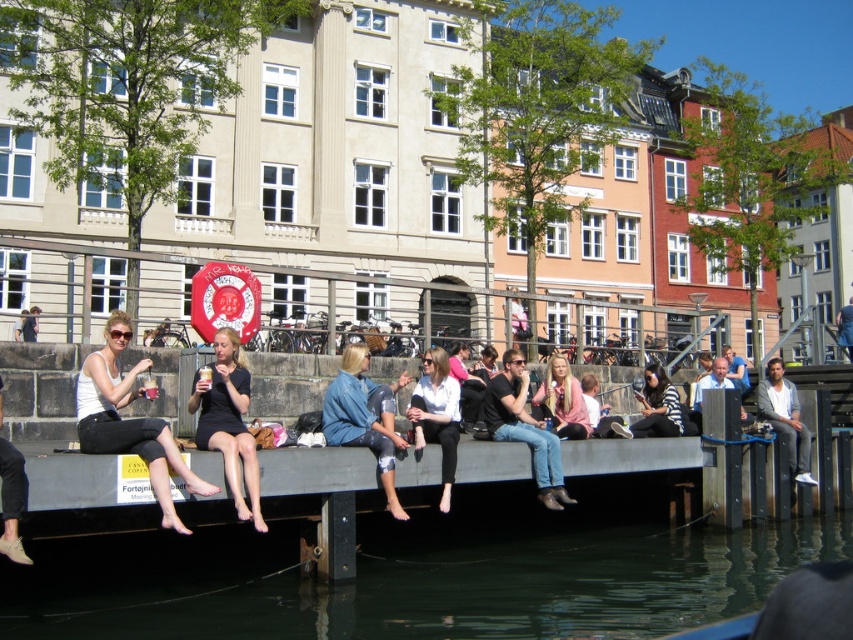
Does matte black pants at lower left appear under dark blue jeans at center?

→ Yes, matte black pants at lower left is below dark blue jeans at center.

Can you confirm if matte black pants at lower left is positioned above dark blue jeans at center?

No.

Is point (0, 538) more distant than point (845, 316)?

No, (0, 538) is closer to viewer.

You are a GUI agent. You are given a task and a screenshot of the screen. Output one action in this format:
    pyautogui.click(x=<x>, y=<y>)
    Task: Click on the matte black pants at lower left
    
    Given the screenshot: What is the action you would take?
    pyautogui.click(x=12, y=500)

Is the position of dark green water at lower center less distant than that of matte white tank top at left?

Yes, dark green water at lower center is in front of matte white tank top at left.

Can you confirm if dark green water at lower center is positioned to the left of matte white tank top at left?

No, dark green water at lower center is not to the left of matte white tank top at left.

Is point (566, 550) positioned before point (167, 490)?

No, (566, 550) is further to viewer.

Find the location of a particular element. The height and width of the screenshot is (640, 853). dark green water at lower center is located at coordinates (416, 584).

Is matte white tank top at left to the left of pink fabric jacket at center from the viewer's perspective?

Indeed, matte white tank top at left is positioned on the left side of pink fabric jacket at center.

Does matte white tank top at left have a smaller size compared to pink fabric jacket at center?

Yes.

Is point (120, 432) behind point (572, 376)?

No, it is in front of (572, 376).

I want to click on matte white tank top at left, so click(129, 420).